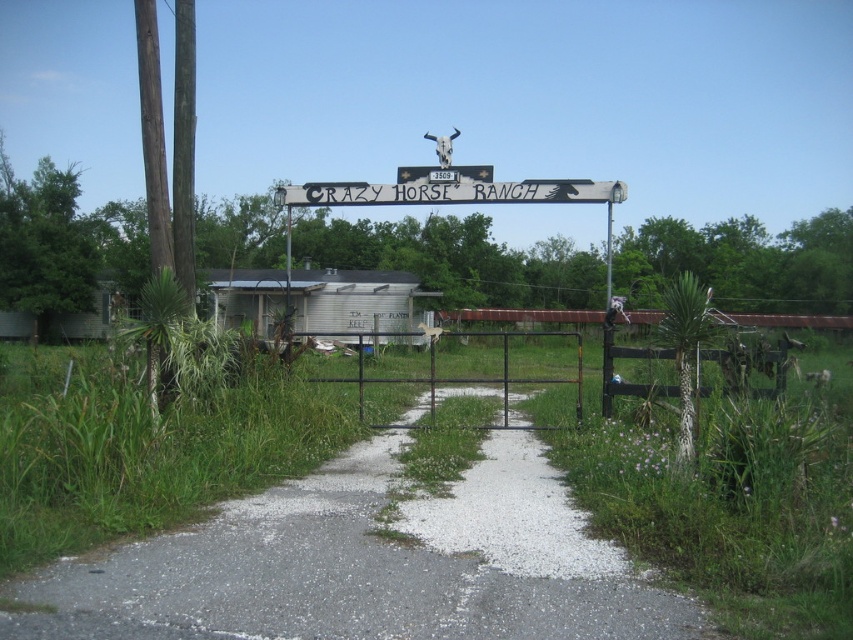
You are standing at the entrance of CRAZY HORSE RANCH and want to place a small decorative rock at each of the two points labeled point [460,385] and point [611,260]. Which point is closer to you where you should place the first rock?

Point [460,385] is closer to the viewer than point [611,260], so you should place the first rock there first.

You are a delivery driver approaching the entrance of CRAZY HORSE RANCH. You need to drive your truck through the gravel path at center and the black metal gate at center. Based on their sizes, which one do you think will be more challenging to navigate?

The gravel path at center has a smaller size compared to the black metal gate at center, so the gravel path at center will be more challenging to navigate because it is narrower than the gate.

You are a delivery driver who needs to pass through the black metal gate at center to deliver a package. However, your truck is 2 meters wide. The wooden signpost at center is in the way. Can your truck fit through the gate without hitting the signpost?

The black metal gate at center occupies less space than the wooden signpost at center. Since the signpost is larger, there might not be enough space for the truck to pass through safely. It is recommended to check the clearance or consider an alternative route.